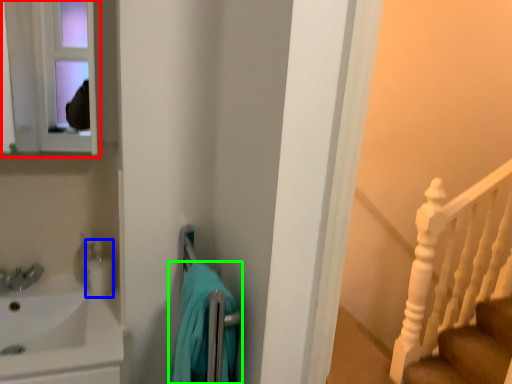
Question: Based on their relative distances, which object is farther from medicine cabinet (highlighted by a red box)? Choose from toiletry (highlighted by a blue box) and bath towel (highlighted by a green box).

Choices:
 (A) toiletry
 (B) bath towel

Answer: (B)